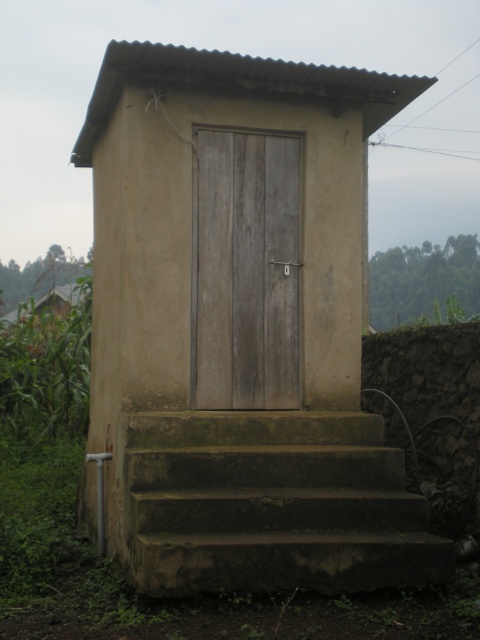
You are standing in front of a small utility shed and see two doors. One is the brown matte door at center and the other is the weathered wood door at center. Which door is positioned lower?

The brown matte door at center is positioned below the weathered wood door at center, so the brown matte door at center is lower.

You are standing at the base of the green mossy concrete stairs at lower center and want to reach the weathered wood door at center. Which object is lower in height?

The green mossy concrete stairs at lower center are lower in height compared to the weathered wood door at center.

You are standing in front of the shed and notice two doors. Which door, the brown matte door at center or the weathered wood door at center, is positioned to the left?

The brown matte door at center is positioned to the left of the weathered wood door at center.